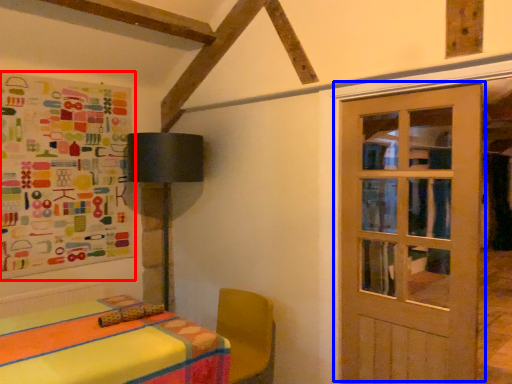
Question: Which object appears farthest to the camera in this image, bulletin board (highlighted by a red box) or door (highlighted by a blue box)?

Choices:
 (A) bulletin board
 (B) door

Answer: (A)